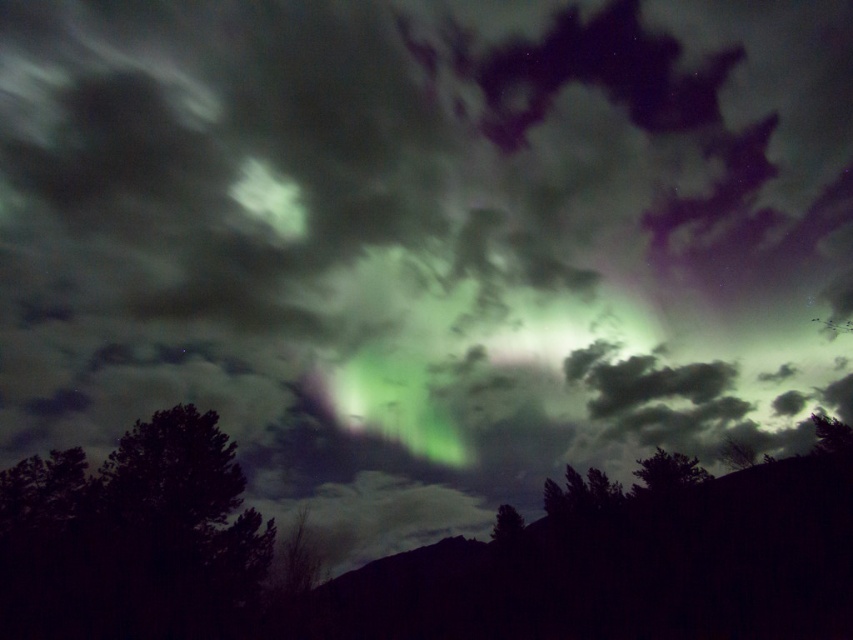
You are standing in a forest looking at the dark green leafy tree at lower left and the green leafy tree at lower right. Which tree is closer to your left side?

The dark green leafy tree at lower left is positioned on the left side of green leafy tree at lower right, so it is closer to your left side.

You are an astronomer observing the night sky and notice two green leafy trees in the foreground. Which tree would appear larger in your telescope view, the green leafy tree at lower right or the green leafy tree at lower center?

The green leafy tree at lower right would appear larger in the telescope view because it is closer to the viewer than the green leafy tree at lower center.